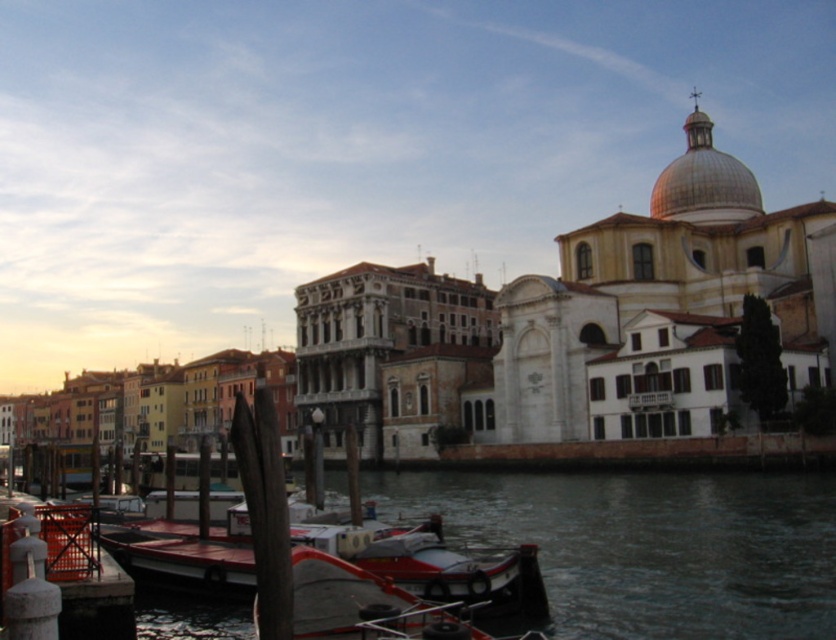
Does smooth concrete canal at lower center have a greater width compared to orange plastic dock at lower left?

Indeed, smooth concrete canal at lower center has a greater width compared to orange plastic dock at lower left.

Is smooth concrete canal at lower center smaller than orange plastic dock at lower left?

Incorrect, smooth concrete canal at lower center is not smaller in size than orange plastic dock at lower left.

Between point (551, 538) and point (111, 637), which one is positioned behind?

The point (551, 538) is behind.

Find the location of a particular element. This screenshot has width=836, height=640. smooth concrete canal at lower center is located at coordinates (650, 545).

Between smooth concrete canal at lower center and white glossy boat at lower center, which one is positioned higher?

white glossy boat at lower center

Is smooth concrete canal at lower center to the left of white glossy boat at lower center from the viewer's perspective?

In fact, smooth concrete canal at lower center is to the right of white glossy boat at lower center.

The width and height of the screenshot is (836, 640). I want to click on smooth concrete canal at lower center, so pyautogui.click(x=650, y=545).

In order to click on white glossy boat at lower center in this screenshot , I will do click(371, 605).

Is the position of white glossy boat at lower center more distant than that of orange plastic dock at lower left?

No, it is in front of orange plastic dock at lower left.

Image resolution: width=836 pixels, height=640 pixels. Identify the location of white glossy boat at lower center. (371, 605).

Locate an element on the screen. Image resolution: width=836 pixels, height=640 pixels. white glossy boat at lower center is located at coordinates (x=371, y=605).